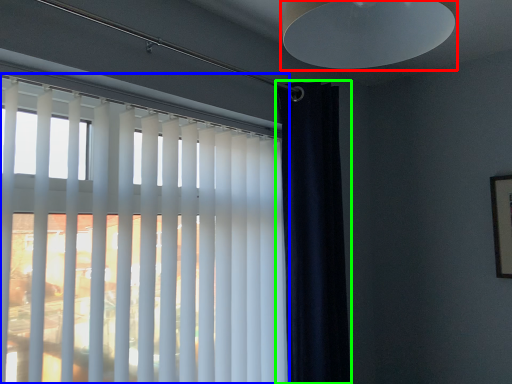
Question: Estimate the real-world distances between objects in this image. Which object is closer to lamp (highlighted by a red box), window blind (highlighted by a blue box) or curtain (highlighted by a green box)?

Choices:
 (A) window blind
 (B) curtain

Answer: (A)